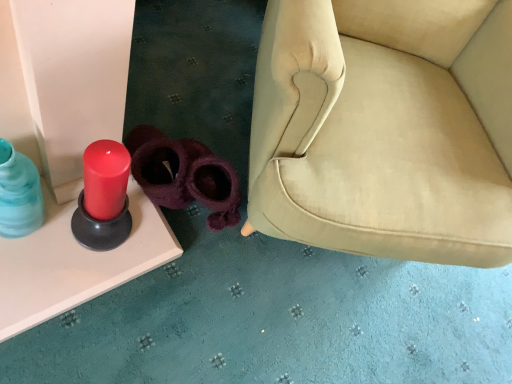
You are a GUI agent. You are given a task and a screenshot of the screen. Output one action in this format:
    pyautogui.click(x=<x>, y=<y>)
    Task: Click on the translucent blue glass bottle at left
    
    Given the screenshot: What is the action you would take?
    pyautogui.click(x=19, y=193)

Is matte red candle at left further to the viewer compared to purple fuzzy slippers at lower center, the first footwear positioned from the right?

No.

Is matte red candle at left bigger or smaller than purple fuzzy slippers at lower center, the first footwear positioned from the right?

Clearly, matte red candle at left is larger in size than purple fuzzy slippers at lower center, the first footwear positioned from the right.

Is matte red candle at left at the left side of purple fuzzy slippers at lower center, the first footwear positioned from the right?

Yes, matte red candle at left is to the left of purple fuzzy slippers at lower center, the first footwear positioned from the right.

Between matte red candle at left and purple fuzzy slippers at lower center, the second footwear from the left, which one has more height?

matte red candle at left.

Does purple fuzzy slippers at center, the 2th footwear when ordered from right to left, appear on the left side of matte red candle at left?

In fact, purple fuzzy slippers at center, the 2th footwear when ordered from right to left, is to the right of matte red candle at left.

Is matte red candle at left at the back of purple fuzzy slippers at center, positioned as the first footwear in left-to-right order?

No, purple fuzzy slippers at center, positioned as the first footwear in left-to-right order, is not facing the opposite direction of matte red candle at left.

Where is `footwear positioned vertically above the purple fuzzy slippers at center, the 2th footwear when ordered from right to left (from a real-world perspective)`? The image size is (512, 384). footwear positioned vertically above the purple fuzzy slippers at center, the 2th footwear when ordered from right to left (from a real-world perspective) is located at coordinates (212, 184).

From the image's perspective, which one is positioned higher, purple fuzzy slippers at lower center, the first footwear positioned from the right, or purple fuzzy slippers at center, positioned as the first footwear in left-to-right order?

purple fuzzy slippers at center, positioned as the first footwear in left-to-right order.

Is there a large distance between purple fuzzy slippers at lower center, the second footwear from the left, and purple fuzzy slippers at center, positioned as the first footwear in left-to-right order?

purple fuzzy slippers at lower center, the second footwear from the left, is actually quite close to purple fuzzy slippers at center, positioned as the first footwear in left-to-right order.

Is purple fuzzy slippers at lower center, the first footwear positioned from the right, in front of or behind purple fuzzy slippers at center, the 2th footwear when ordered from right to left, in the image?

purple fuzzy slippers at lower center, the first footwear positioned from the right, is positioned farther from the viewer than purple fuzzy slippers at center, the 2th footwear when ordered from right to left.

Would you say translucent blue glass bottle at left contains purple fuzzy slippers at center, positioned as the first footwear in left-to-right order?

Definitely not — purple fuzzy slippers at center, positioned as the first footwear in left-to-right order, is not inside translucent blue glass bottle at left.

From the image's perspective, relative to purple fuzzy slippers at center, positioned as the first footwear in left-to-right order, is translucent blue glass bottle at left above or below?

translucent blue glass bottle at left is situated lower than purple fuzzy slippers at center, positioned as the first footwear in left-to-right order, in the image.

Which of these two, matte red candle at left or purple fuzzy slippers at center, positioned as the first footwear in left-to-right order, is bigger?

matte red candle at left is bigger.

How different are the orientations of matte red candle at left and purple fuzzy slippers at center, positioned as the first footwear in left-to-right order, in degrees?

31.9 degrees.

How distant is matte red candle at left from purple fuzzy slippers at center, positioned as the first footwear in left-to-right order?

A distance of 7.07 inches exists between matte red candle at left and purple fuzzy slippers at center, positioned as the first footwear in left-to-right order.

Considering the relative sizes of matte red candle at left and purple fuzzy slippers at center, the 2th footwear when ordered from right to left, in the image provided, is matte red candle at left taller than purple fuzzy slippers at center, the 2th footwear when ordered from right to left,?

Yes.

Is translucent blue glass bottle at left surrounding matte red candle at left?

That's incorrect, matte red candle at left is not inside translucent blue glass bottle at left.

Considering the relative sizes of translucent blue glass bottle at left and matte red candle at left in the image provided, is translucent blue glass bottle at left bigger than matte red candle at left?

Actually, translucent blue glass bottle at left might be smaller than matte red candle at left.

Can you confirm if translucent blue glass bottle at left is taller than matte red candle at left?

No.

Is point (31, 208) farther from camera compared to point (33, 314)?

No, (31, 208) is in front of (33, 314).

Is purple fuzzy slippers at lower center, the first footwear positioned from the right, turned away from matte red candle at left?

No, purple fuzzy slippers at lower center, the first footwear positioned from the right, is not facing away from matte red candle at left.

At what (x,y) coordinates should I click in order to perform the action: click on the 1st footwear located beneath the matte red candle at left (from a real-world perspective). Please return your answer as a coordinate pair (x, y). Looking at the image, I should click on (212, 184).

Who is smaller, purple fuzzy slippers at lower center, the second footwear from the left, or matte red candle at left?

purple fuzzy slippers at lower center, the second footwear from the left.

Based on the photo, what's the angular difference between purple fuzzy slippers at lower center, the first footwear positioned from the right, and matte red candle at left's facing directions?

The facing directions of purple fuzzy slippers at lower center, the first footwear positioned from the right, and matte red candle at left are 36.7 degrees apart.

From a real-world perspective, count 1st footwears downward from the matte red candle at left and point to it. Please provide its 2D coordinates.

[(212, 184)]

Find the location of `furniture above the purple fuzzy slippers at center, the 2th footwear when ordered from right to left (from the image's perspective)`. furniture above the purple fuzzy slippers at center, the 2th footwear when ordered from right to left (from the image's perspective) is located at coordinates (67, 151).

Estimate the real-world distances between objects in this image. Which object is further from purple fuzzy slippers at lower center, the first footwear positioned from the right, translucent blue glass bottle at left or purple fuzzy slippers at center, positioned as the first footwear in left-to-right order?

Among the two, translucent blue glass bottle at left is located further to purple fuzzy slippers at lower center, the first footwear positioned from the right.

From the image, which object appears to be nearer to translucent blue glass bottle at left, purple fuzzy slippers at center, positioned as the first footwear in left-to-right order, or matte red candle at left?

matte red candle at left is positioned closer to the anchor translucent blue glass bottle at left.

Based on the photo, looking at the image, which one is located further to purple fuzzy slippers at center, the 2th footwear when ordered from right to left, translucent blue glass bottle at left or purple fuzzy slippers at lower center, the first footwear positioned from the right?

translucent blue glass bottle at left is further to purple fuzzy slippers at center, the 2th footwear when ordered from right to left.

Looking at the image, which one is located closer to translucent blue glass bottle at left, purple fuzzy slippers at lower center, the first footwear positioned from the right, or purple fuzzy slippers at center, the 2th footwear when ordered from right to left?

purple fuzzy slippers at center, the 2th footwear when ordered from right to left.

In the scene shown: From the image, which object appears to be nearer to matte red candle at left, purple fuzzy slippers at lower center, the second footwear from the left, or translucent blue glass bottle at left?

The object closer to matte red candle at left is translucent blue glass bottle at left.

Looking at the image, which one is located further to matte red candle at left, purple fuzzy slippers at center, the 2th footwear when ordered from right to left, or purple fuzzy slippers at lower center, the second footwear from the left?

purple fuzzy slippers at lower center, the second footwear from the left, is further to matte red candle at left.

Estimate the real-world distances between objects in this image. Which object is further from purple fuzzy slippers at center, positioned as the first footwear in left-to-right order, matte red candle at left or purple fuzzy slippers at lower center, the first footwear positioned from the right?

Based on the image, matte red candle at left appears to be further to purple fuzzy slippers at center, positioned as the first footwear in left-to-right order.

Looking at this image, looking at the image, which one is located further to matte red candle at left, purple fuzzy slippers at center, positioned as the first footwear in left-to-right order, or translucent blue glass bottle at left?

Among the two, purple fuzzy slippers at center, positioned as the first footwear in left-to-right order, is located further to matte red candle at left.

Locate an element on the screen. The image size is (512, 384). footwear positioned between matte red candle at left and purple fuzzy slippers at lower center, the first footwear positioned from the right, from near to far is located at coordinates (159, 166).

Locate an element on the screen. This screenshot has height=384, width=512. footwear between translucent blue glass bottle at left and purple fuzzy slippers at lower center, the first footwear positioned from the right, in the horizontal direction is located at coordinates (159, 166).

At what (x,y) coordinates should I click in order to perform the action: click on bottle between matte red candle at left and purple fuzzy slippers at center, the 2th footwear when ordered from right to left, along the z-axis. Please return your answer as a coordinate pair (x, y). Image resolution: width=512 pixels, height=384 pixels. Looking at the image, I should click on (19, 193).

This screenshot has height=384, width=512. What are the coordinates of `bottle between matte red candle at left and purple fuzzy slippers at lower center, the second footwear from the left, along the z-axis` in the screenshot? It's located at (19, 193).